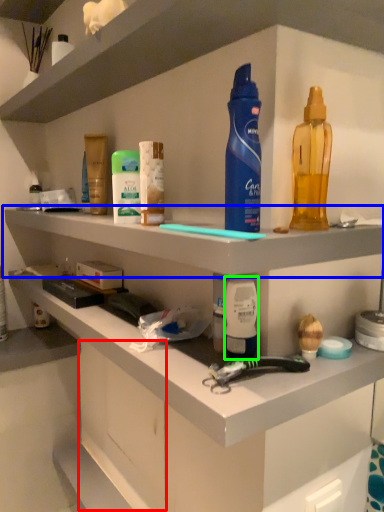
Question: Which object is positioned farthest from drawer (highlighted by a red box)? Select from shelf (highlighted by a blue box) and toiletry (highlighted by a green box).

Choices:
 (A) shelf
 (B) toiletry

Answer: (B)